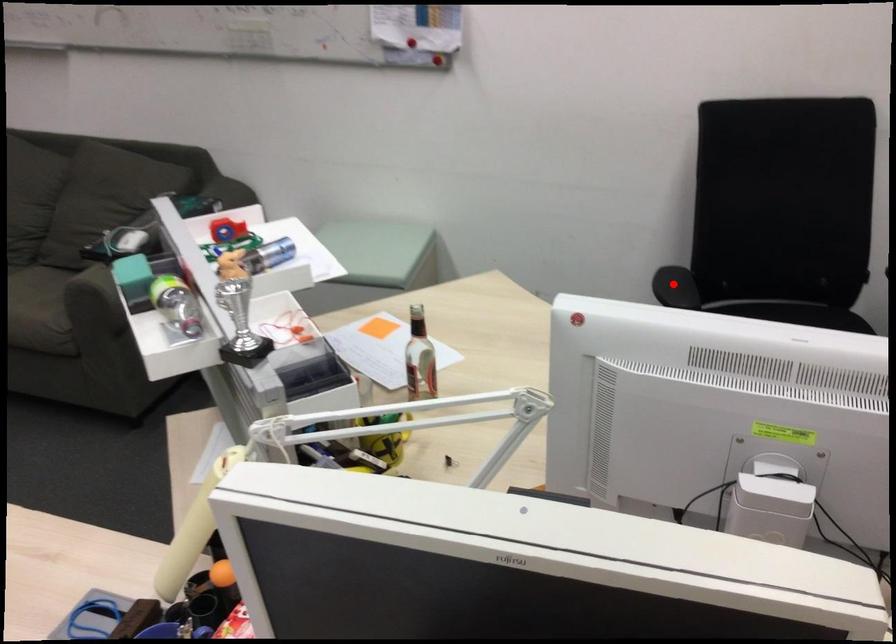
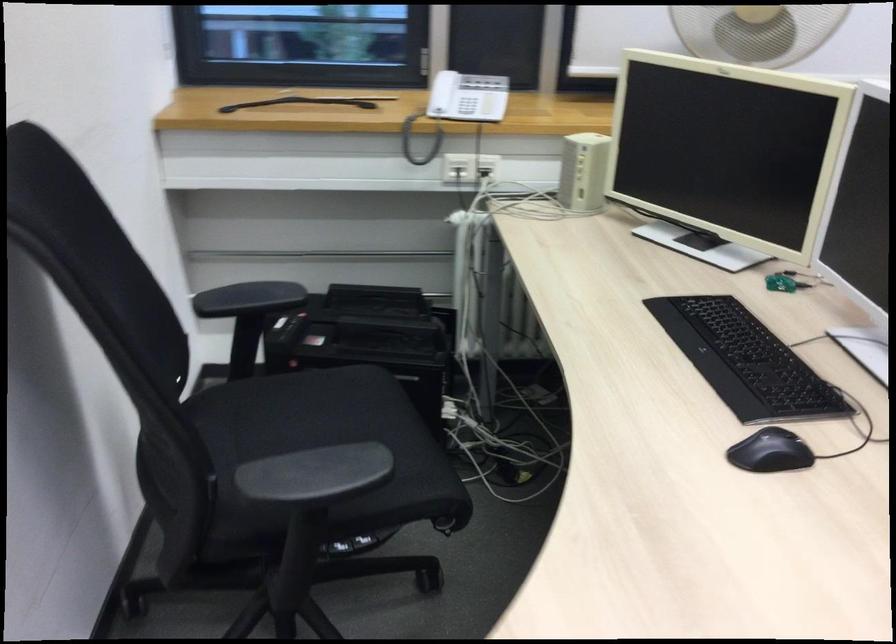
Find the pixel in the second image that matches the highlighted location in the first image.

(315, 475)